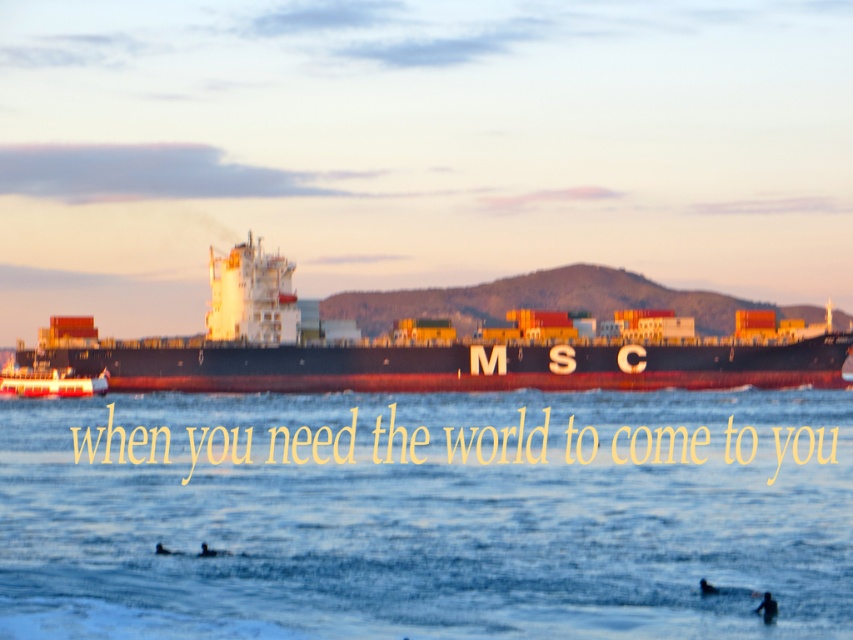
You are a photographer trying to capture the black matte cargo ship at center in your shot. You notice that the blue water at center is partially obscuring the ship. Which object should you adjust your camera angle to focus on, considering their relative widths?

The blue water at center has a lesser width compared to the black matte cargo ship at center, so you should adjust your camera angle to focus on the black matte cargo ship at center since it is wider and less obscured by the water.

You are standing at the point where the viewer is located in the coastal scene. A rescue boat needs to reach a distress signal coming from the point at coordinates point (x=387, y=520). If the rescue boat can travel 200 feet per minute, how many minutes will it take to reach the point?

The point at coordinates point (x=387, y=520) is 195.77 feet away from the viewer. The rescue boat can travel 200 feet per minute, so it will take approximately 0.97885 minutes, which is roughly 58.73 seconds, to reach the point.